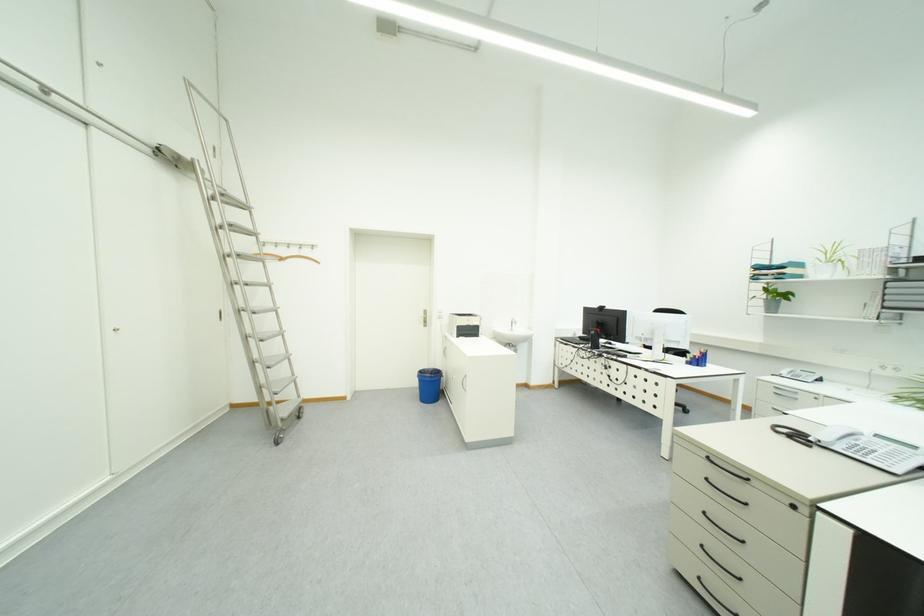
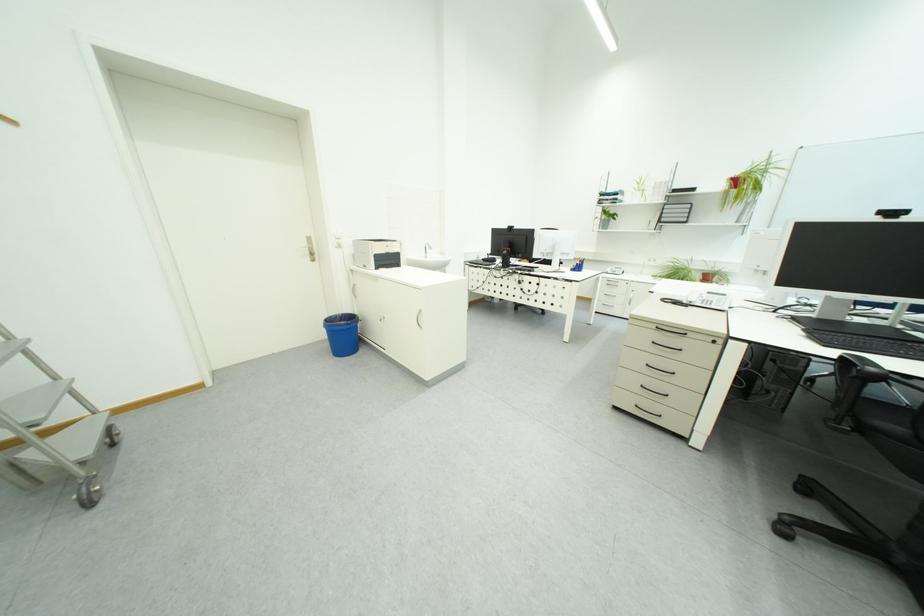
First-person continuous shooting, in which direction is the camera rotating?

The camera rotated toward right-down.